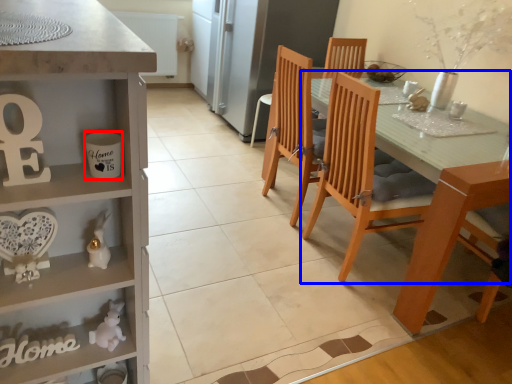
Question: Which of the following is the farthest to the observer, coffee cup (highlighted by a red box) or chair (highlighted by a blue box)?

Choices:
 (A) coffee cup
 (B) chair

Answer: (B)